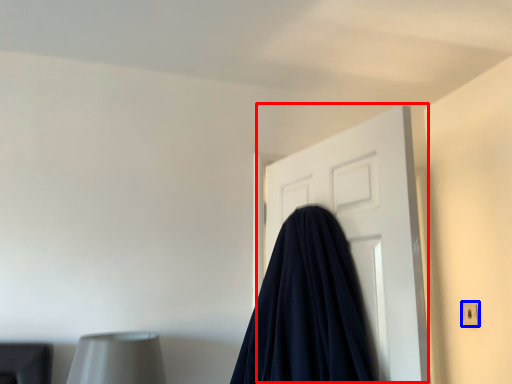
Question: Which of the following is the closest to the observer, door (highlighted by a red box) or electric outlet (highlighted by a blue box)?

Choices:
 (A) door
 (B) electric outlet

Answer: (A)